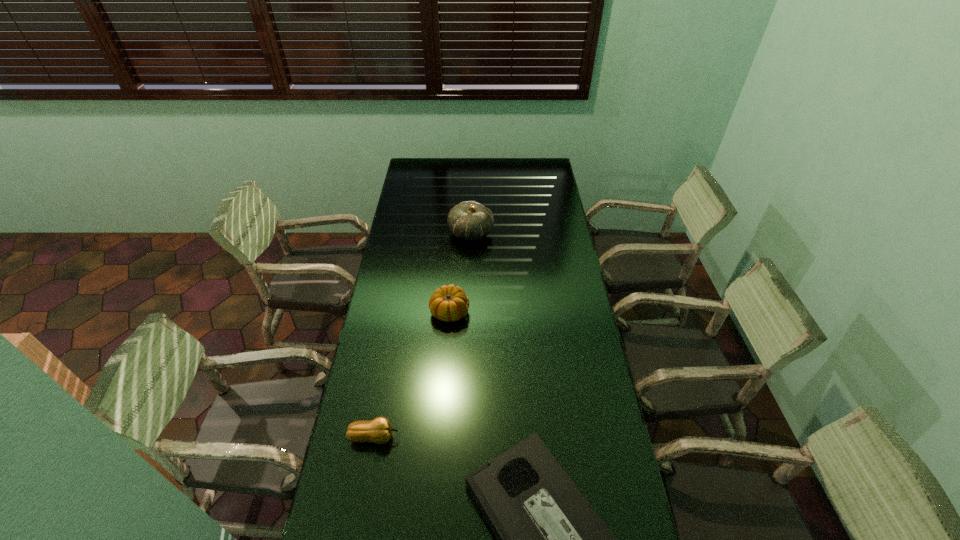
The width and height of the screenshot is (960, 540). What are the coordinates of `the farthest gourd` in the screenshot? It's located at (469, 220).

You are a GUI agent. You are given a task and a screenshot of the screen. Output one action in this format:
    pyautogui.click(x=<x>, y=<y>)
    Task: Click on the tallest object
    The height and width of the screenshot is (540, 960).
    Given the screenshot: What is the action you would take?
    pyautogui.click(x=469, y=220)

Identify the location of the third nearest object. (448, 303).

I want to click on the second shortest gourd, so click(x=448, y=303).

Where is `the leftmost object`? The image size is (960, 540). the leftmost object is located at coordinates (379, 430).

Identify the location of the shortest gourd. The image size is (960, 540). (379, 430).

Identify the location of vacant region located 0.200m on the right of the farthest object. (537, 233).

Locate an element on the screen. The width and height of the screenshot is (960, 540). vacant position located 0.180m on the right of the third nearest object is located at coordinates (516, 312).

Find the location of a particular element. The image size is (960, 540). vacant area located 0.150m on the stem side of the shortest gourd is located at coordinates 448,437.

Where is `object that is at the left edge`? object that is at the left edge is located at coordinates (379, 430).